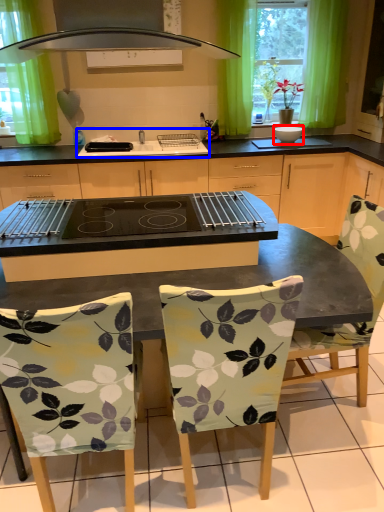
Question: Among these objects, which one is nearest to the camera, appliance (highlighted by a red box) or sink (highlighted by a blue box)?

Choices:
 (A) appliance
 (B) sink

Answer: (B)